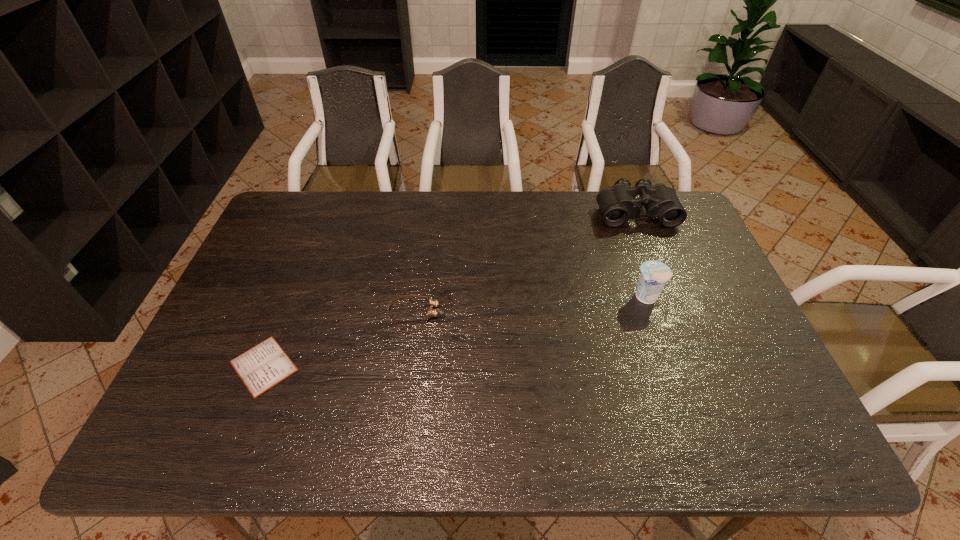
In the image, there is a desktop. Identify the location of vacant space at the near right corner. (771, 441).

I want to click on free space between the farthest object and the yogurt, so click(640, 254).

Locate an element on the screen. empty space that is in between the farthest object and the goggles is located at coordinates (526, 261).

You are a GUI agent. You are given a task and a screenshot of the screen. Output one action in this format:
    pyautogui.click(x=<x>, y=<y>)
    Task: Click on the free spot between the binoculars and the leftmost object
    This screenshot has height=540, width=960.
    Given the screenshot: What is the action you would take?
    pyautogui.click(x=449, y=289)

Image resolution: width=960 pixels, height=540 pixels. I want to click on vacant area that lies between the shortest object and the yogurt, so click(455, 332).

Locate an element on the screen. free space between the yogurt and the farthest object is located at coordinates (640, 254).

Find the location of `free space between the binoculars and the diary`. free space between the binoculars and the diary is located at coordinates (449, 289).

Locate an element on the screen. The width and height of the screenshot is (960, 540). empty space that is in between the shortest object and the third tallest object is located at coordinates (340, 339).

At what (x,y) coordinates should I click in order to perform the action: click on unoccupied area between the goggles and the farthest object. Please return your answer as a coordinate pair (x, y). This screenshot has height=540, width=960. Looking at the image, I should click on (526, 261).

Where is `unoccupied position between the binoculars and the diary`? unoccupied position between the binoculars and the diary is located at coordinates (449, 289).